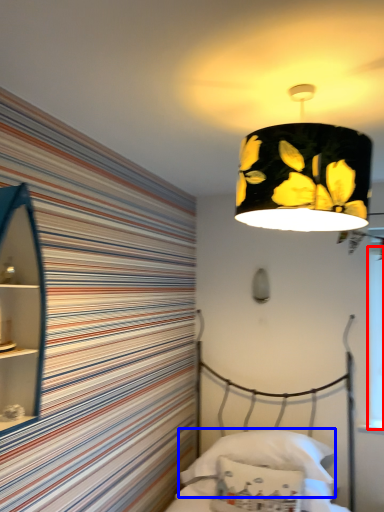
Question: Among these objects, which one is farthest to the camera, window screen (highlighted by a red box) or pillow (highlighted by a blue box)?

Choices:
 (A) window screen
 (B) pillow

Answer: (A)